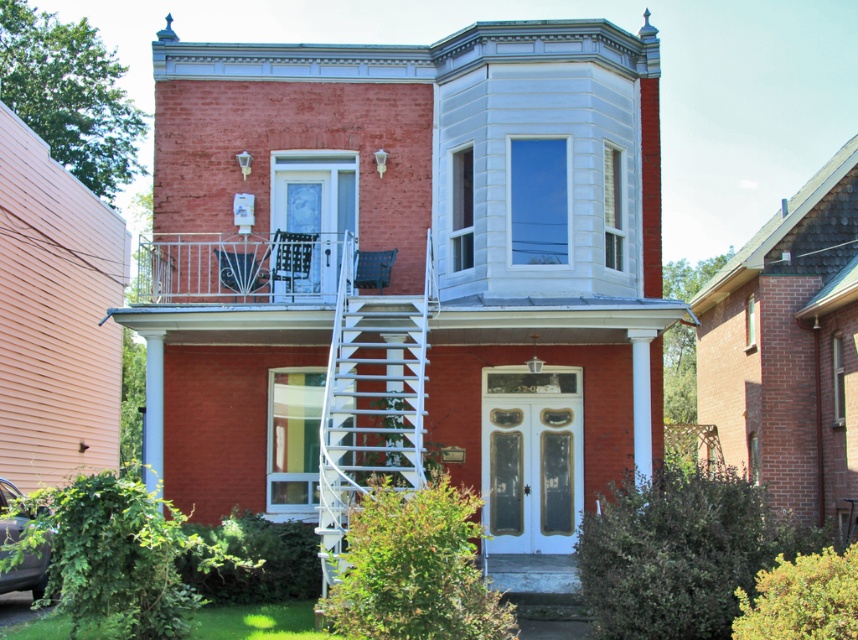
Question: Considering the real-world distances, which object is closest to the white metal balcony at upper center?

Choices:
 (A) shiny black car at lower left
 (B) white metal staircase at center

Answer: (B)

Question: Which object is farther from the camera taking this photo?

Choices:
 (A) shiny black car at lower left
 (B) white metal balcony at upper center
 (C) white metal staircase at center

Answer: (B)

Question: Considering the relative positions of white metal balcony at upper center and shiny black car at lower left in the image provided, where is white metal balcony at upper center located with respect to shiny black car at lower left?

Choices:
 (A) above
 (B) below

Answer: (A)

Question: Does white metal balcony at upper center appear on the right side of shiny black car at lower left?

Choices:
 (A) no
 (B) yes

Answer: (A)

Question: Which object is farther from the camera taking this photo?

Choices:
 (A) shiny black car at lower left
 (B) white metal staircase at center
 (C) white metal balcony at upper center

Answer: (C)

Question: From the image, what is the correct spatial relationship of white metal staircase at center in relation to white metal balcony at upper center?

Choices:
 (A) above
 (B) below

Answer: (B)